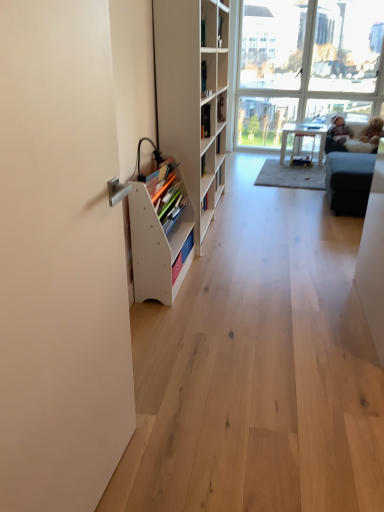
You are a GUI agent. You are given a task and a screenshot of the screen. Output one action in this format:
    pyautogui.click(x=<x>, y=<y>)
    Task: Click on the vacant area that is in front of white matte bookshelf at left, positioned as the 2th shelf in bottom-to-top order
    The width and height of the screenshot is (384, 512).
    Given the screenshot: What is the action you would take?
    pyautogui.click(x=251, y=268)